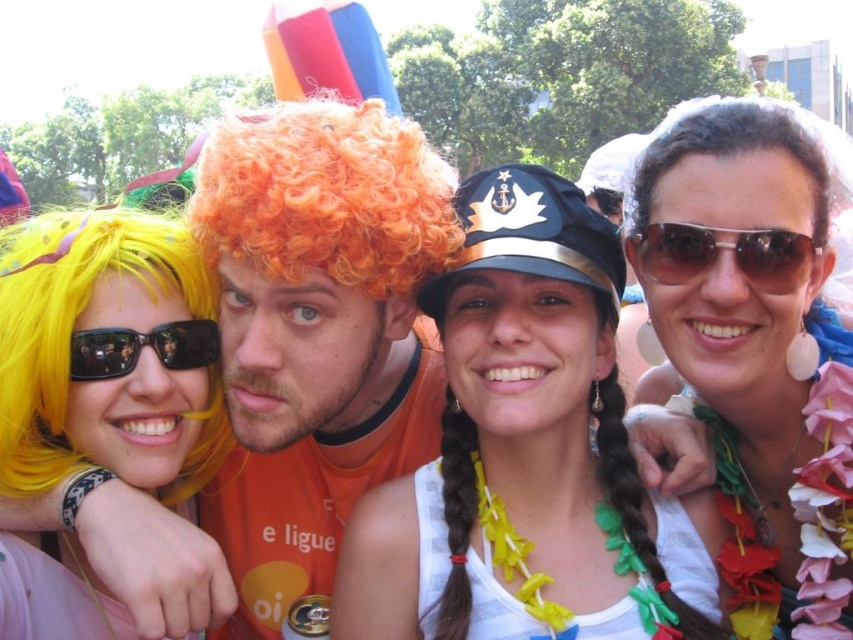
Question: Is white matte hat at center wider than brown curly wig at upper right?

Choices:
 (A) yes
 (B) no

Answer: (B)

Question: Where is pearl necklace at upper right located in relation to brown curly wig at upper right in the image?

Choices:
 (A) right
 (B) left

Answer: (A)

Question: Which is farther from the shiny yellow wig at left?

Choices:
 (A) white matte hat at center
 (B) pearl necklace at upper right
 (C) brown reflective sunglasses at upper right
 (D) black reflective sunglasses at upper left

Answer: (B)

Question: Which point is farther from the camera taking this photo?

Choices:
 (A) (683, 240)
 (B) (300, 250)

Answer: (A)

Question: Can you confirm if orange curly wig at center is positioned to the left of black reflective sunglasses at upper left?

Choices:
 (A) yes
 (B) no

Answer: (B)

Question: Among these objects, which one is nearest to the camera?

Choices:
 (A) black reflective sunglasses at upper left
 (B) orange curly wig at center

Answer: (B)